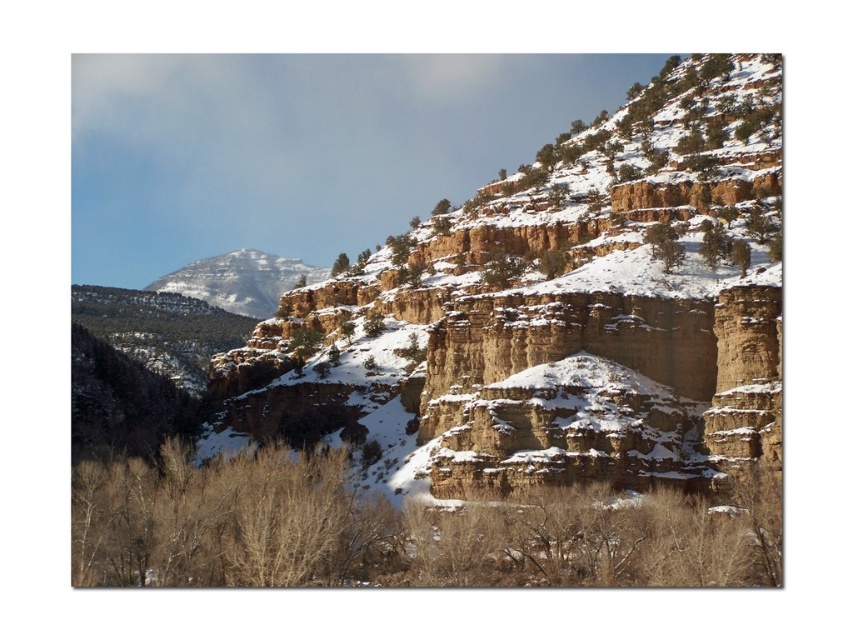
You are standing in the snow at the base of the rugged landscape. There is a rustic stone cliff at center at point (491, 381). What is the coordinate of the rustic stone cliff at center?

The rustic stone cliff at center is located at point (491, 381).